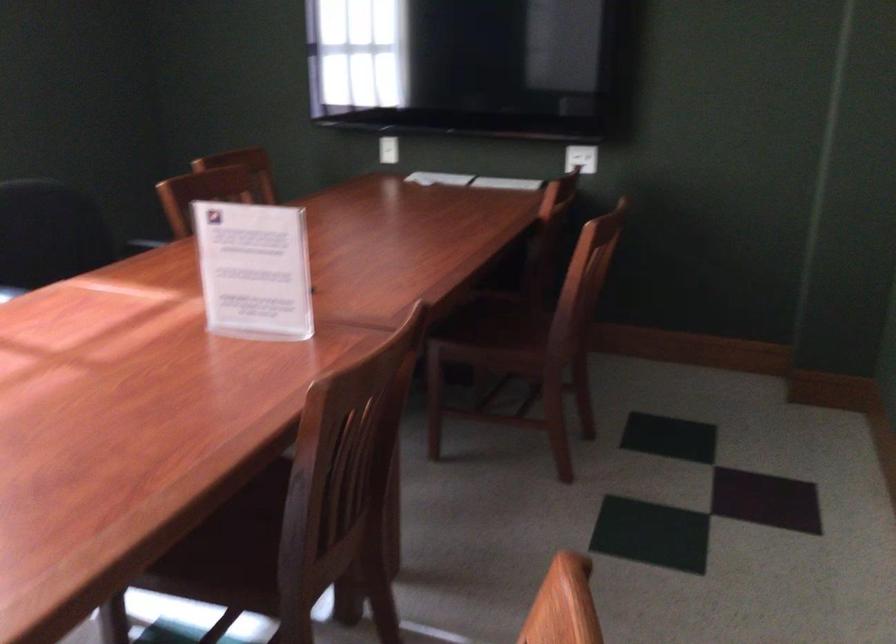
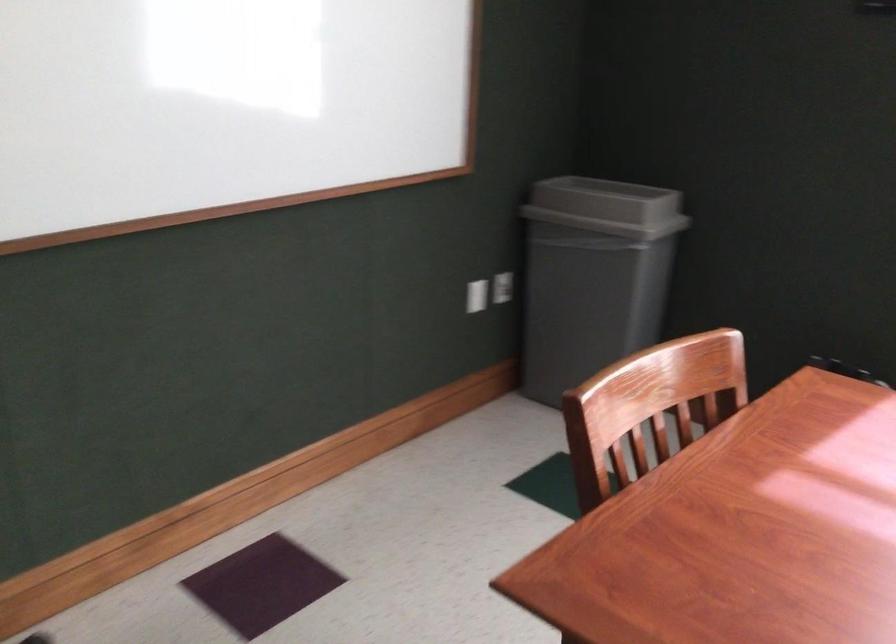
From the picture: The images are taken continuously from a first-person perspective. In which direction is your viewpoint rotating?

The rotation direction of the camera is left-down.